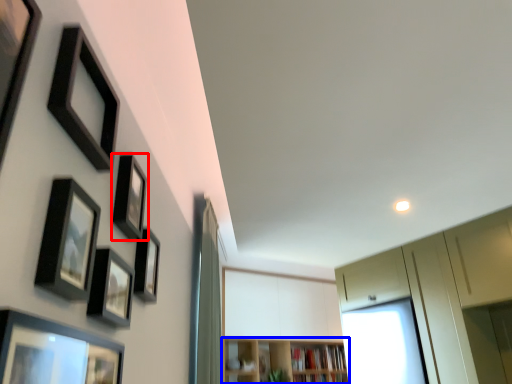
Question: Among these objects, which one is farthest to the camera, picture frame (highlighted by a red box) or shelf (highlighted by a blue box)?

Choices:
 (A) picture frame
 (B) shelf

Answer: (B)